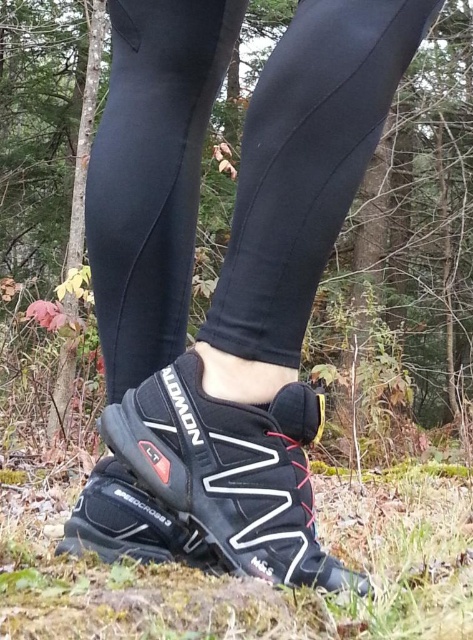
Question: Which point is farther from the camera taking this photo?

Choices:
 (A) (263, 291)
 (B) (245, 538)

Answer: (A)

Question: Is black matte leggings at center above black mesh shoe at center?

Choices:
 (A) no
 (B) yes

Answer: (B)

Question: Is black matte leggings at center bigger than black mesh shoe at center?

Choices:
 (A) no
 (B) yes

Answer: (B)

Question: Which point is closer to the camera taking this photo?

Choices:
 (A) (259, 566)
 (B) (294, 64)

Answer: (A)

Question: Is black matte leggings at center thinner than black mesh shoe at center?

Choices:
 (A) no
 (B) yes

Answer: (B)